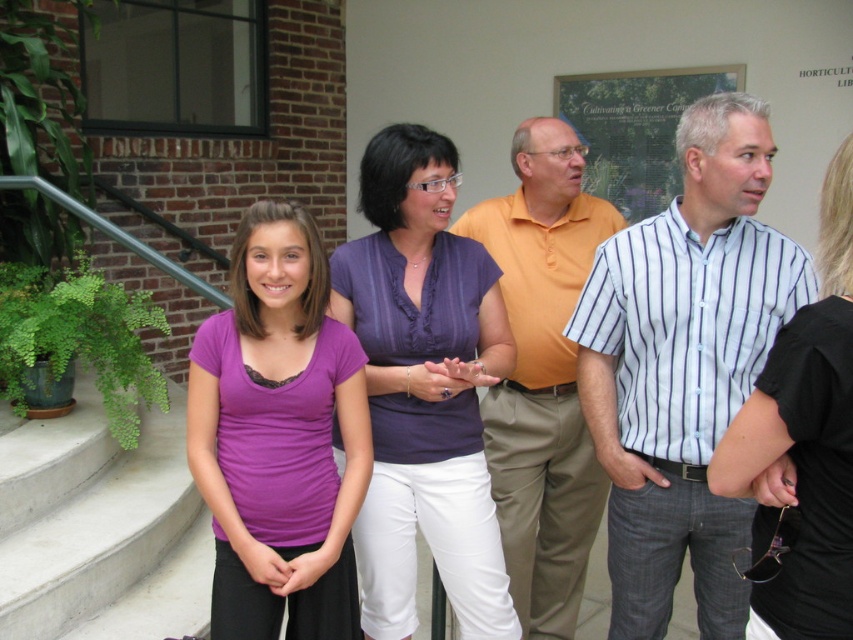
Is concrete stairs at lower left above white striped shirt at right?

No, concrete stairs at lower left is not above white striped shirt at right.

Measure the distance between point (x=22, y=550) and camera.

Point (x=22, y=550) is 2.78 meters away from camera.

What do you see at coordinates (102, 529) in the screenshot?
I see `concrete stairs at lower left` at bounding box center [102, 529].

The width and height of the screenshot is (853, 640). Identify the location of concrete stairs at lower left. (102, 529).

Can you confirm if purple satin blouse at center is wider than orange cotton shirt at center?

In fact, purple satin blouse at center might be narrower than orange cotton shirt at center.

Can you confirm if purple satin blouse at center is smaller than orange cotton shirt at center?

Indeed, purple satin blouse at center has a smaller size compared to orange cotton shirt at center.

Looking at this image, who is more distant from viewer, (358,326) or (550,448)?

The point (550,448) is more distant.

At what (x,y) coordinates should I click in order to perform the action: click on purple satin blouse at center. Please return your answer as a coordinate pair (x, y). This screenshot has height=640, width=853. Looking at the image, I should click on (424, 387).

Is point (326, 324) positioned after point (103, 456)?

No, (326, 324) is closer to viewer.

In order to click on purple fabric shirt at center in this screenshot , I will do `click(279, 436)`.

Is point (248, 584) in front of point (117, 512)?

Yes, it is.

Where is `purple fabric shirt at center`? purple fabric shirt at center is located at coordinates (279, 436).